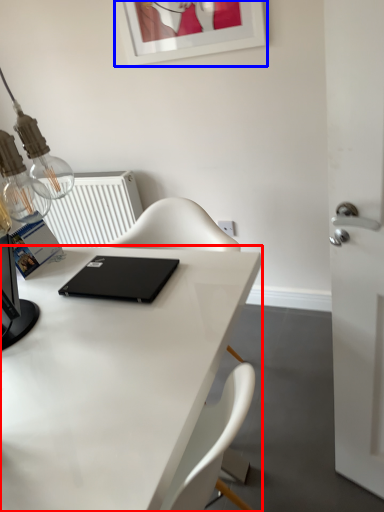
Question: Which object is further to the camera taking this photo, desk (highlighted by a red box) or picture frame (highlighted by a blue box)?

Choices:
 (A) desk
 (B) picture frame

Answer: (B)